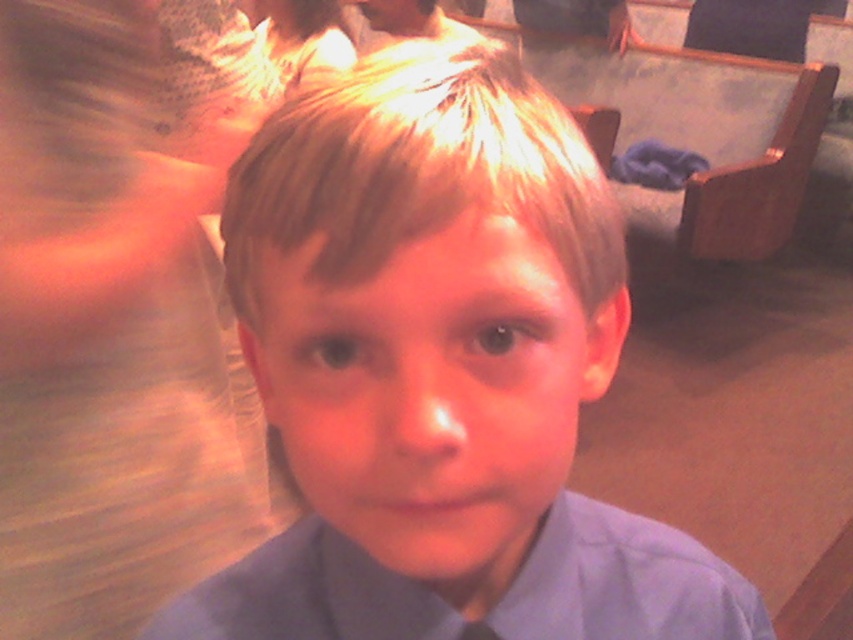
Question: Where is matte blue shirt at center located in relation to blonde smooth hair at center in the image?

Choices:
 (A) below
 (B) above

Answer: (A)

Question: Which point appears closest to the camera in this image?

Choices:
 (A) (293, 115)
 (B) (30, 243)
 (C) (345, 552)
 (D) (549, 97)

Answer: (A)

Question: Does matte blue shirt at center appear on the right side of matte blue dress shirt at center?

Choices:
 (A) no
 (B) yes

Answer: (A)

Question: Among these points, which one is farthest from the camera?

Choices:
 (A) (276, 129)
 (B) (543, 353)

Answer: (A)

Question: Is blonde smooth hair at center smaller than matte blue dress shirt at center?

Choices:
 (A) yes
 (B) no

Answer: (A)

Question: Based on their relative distances, which object is nearer to the matte blue dress shirt at center?

Choices:
 (A) light blue fabric at center
 (B) blonde smooth hair at center
 (C) matte blue shirt at center

Answer: (C)